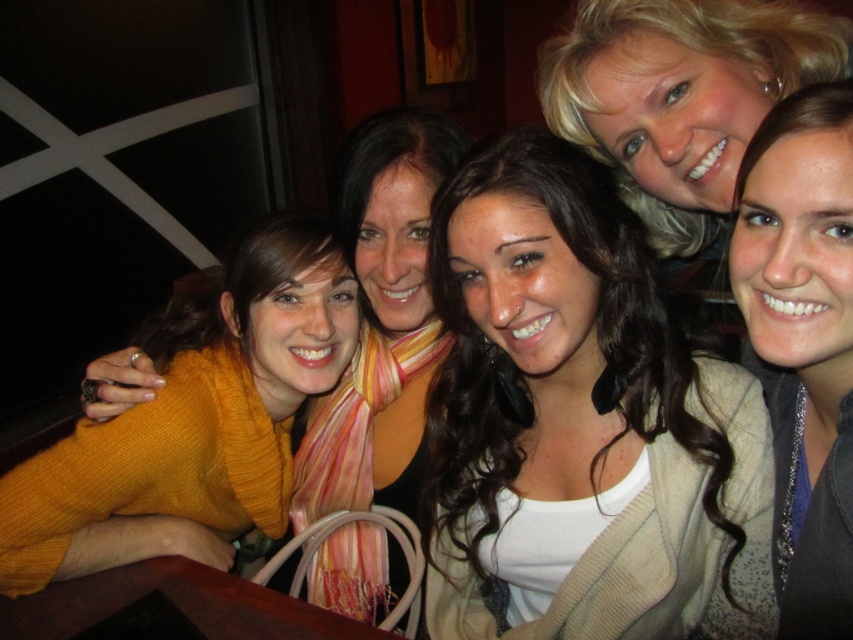
You are a photographer trying to capture a closeup shot of the matte yellow sweater at left and the matte gray sweater at upper right. Given that your camera has a maximum focus range of 80 centimeters, will you be able to photograph both sweaters in the same frame without moving the camera?

The matte yellow sweater at left is 79.68 centimeters away from the matte gray sweater at upper right. Since the distance between them is within the camera maximum focus range of 80 centimeters, you can photograph both sweaters in the same frame without moving the camera.

You are a photographer adjusting the camera settings for a group photo. You notice the white matte shirt at center and the matte gray sweater at upper right in the frame. Which of these two items should you focus on first if you want to ensure proper exposure for the taller object?

The white matte shirt at center is much taller than the matte gray sweater at upper right, so you should focus on the white matte shirt at center first to ensure proper exposure for the taller object.